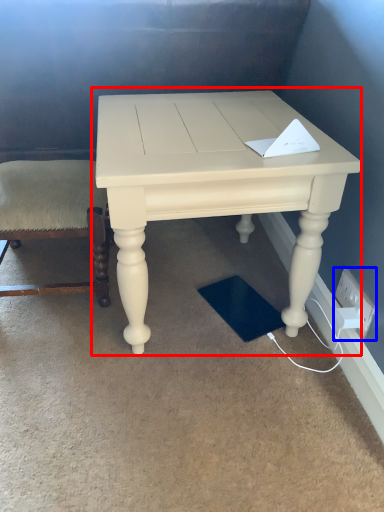
Question: Which object is further to the camera taking this photo, table (highlighted by a red box) or electric outlet (highlighted by a blue box)?

Choices:
 (A) table
 (B) electric outlet

Answer: (B)